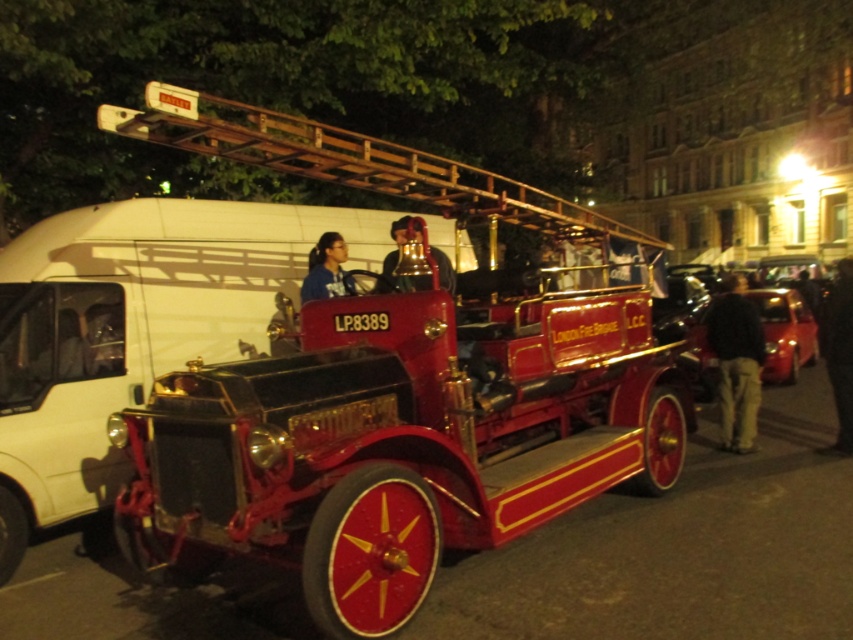
Question: Which point appears closest to the camera in this image?

Choices:
 (A) (321, 275)
 (B) (165, 273)
 (C) (444, 269)

Answer: (C)

Question: Which object is positioned farthest from the black leather pants at lower right?

Choices:
 (A) blue fabric jacket at center
 (B) dark brown leather jacket at lower right
 (C) shiny red car at right
 (D) shiny black bell at center

Answer: (B)

Question: Can you confirm if shiny red fire truck at center is positioned to the right of shiny red car at right?

Choices:
 (A) no
 (B) yes

Answer: (A)

Question: Among these points, which one is farthest from the camera?

Choices:
 (A) (228, 394)
 (B) (784, 308)

Answer: (B)

Question: Does shiny red car at right come behind blue fabric jacket at center?

Choices:
 (A) yes
 (B) no

Answer: (A)

Question: Is white matte van at center to the right of shiny black bell at center from the viewer's perspective?

Choices:
 (A) no
 (B) yes

Answer: (A)